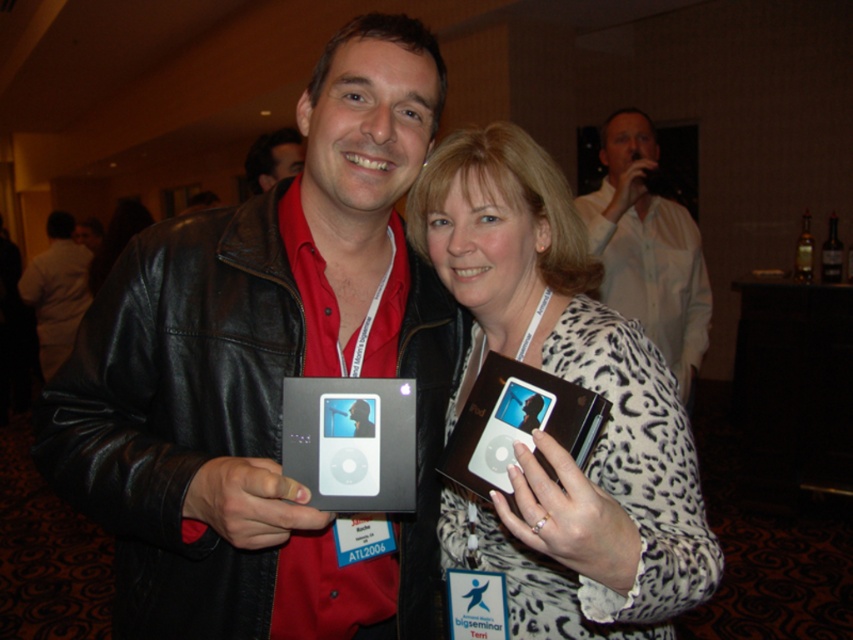
Does white shirt at upper center have a lesser height compared to white shirt at left?

Yes, white shirt at upper center is shorter than white shirt at left.

Between white shirt at upper center and white shirt at left, which one has less height?

Standing shorter between the two is white shirt at upper center.

Locate an element on the screen. This screenshot has height=640, width=853. white shirt at upper center is located at coordinates (647, 248).

Can you confirm if white leopard print shirt at center is positioned to the left of satin brown ipod at center?

No, white leopard print shirt at center is not to the left of satin brown ipod at center.

This screenshot has width=853, height=640. Identify the location of white leopard print shirt at center. (573, 381).

Can you confirm if satin black ipod at center is taller than white shirt at left?

No.

Between satin black ipod at center and white shirt at left, which one is positioned higher?

white shirt at left is higher up.

Locate an element on the screen. satin black ipod at center is located at coordinates (351, 442).